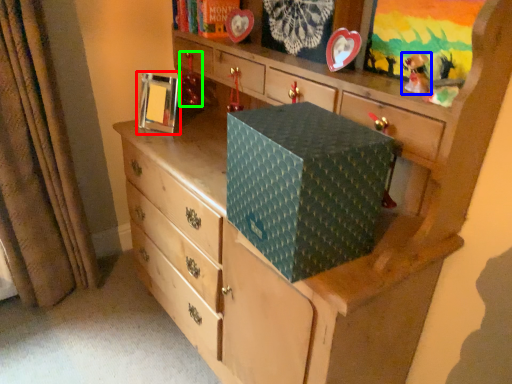
Question: Which object is the closest to the picture frame (highlighted by a red box)? Choose among these: toy (highlighted by a blue box) or toy (highlighted by a green box).

Choices:
 (A) toy
 (B) toy

Answer: (B)